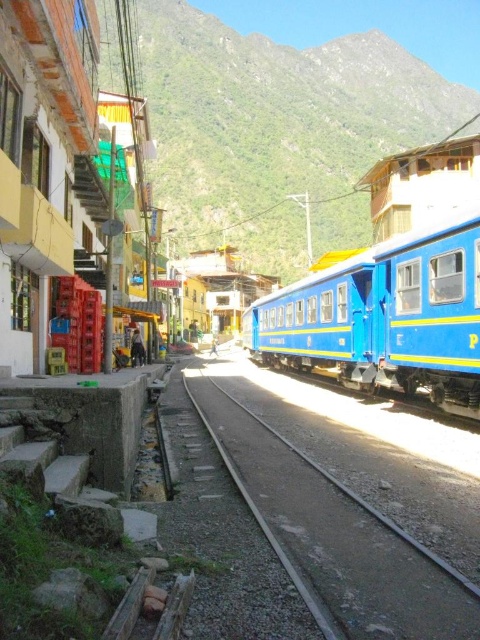
The height and width of the screenshot is (640, 480). In order to click on green leafy mountain at upper center in this screenshot , I will do `click(276, 131)`.

Who is positioned more to the right, green leafy mountain at upper center or blue matte train at right?

green leafy mountain at upper center is more to the right.

From the picture: Who is more distant from viewer, (x=268, y=236) or (x=326, y=268)?

Point (x=268, y=236)

You are a GUI agent. You are given a task and a screenshot of the screen. Output one action in this format:
    pyautogui.click(x=<x>, y=<y>)
    Task: Click on the green leafy mountain at upper center
    
    Given the screenshot: What is the action you would take?
    pyautogui.click(x=276, y=131)

Is blue matte train at right to the left of gray gravel track at center from the viewer's perspective?

In fact, blue matte train at right is to the right of gray gravel track at center.

Is blue matte train at right to the right of gray gravel track at center from the viewer's perspective?

Indeed, blue matte train at right is positioned on the right side of gray gravel track at center.

Does point (266, 304) come closer to viewer compared to point (445, 634)?

No, (266, 304) is behind (445, 634).

Locate an element on the screen. The width and height of the screenshot is (480, 640). blue matte train at right is located at coordinates (393, 289).

Can you confirm if green leafy mountain at upper center is wider than gray gravel track at center?

Yes.

Is green leafy mountain at upper center shorter than gray gravel track at center?

Incorrect, green leafy mountain at upper center's height does not fall short of gray gravel track at center's.

The image size is (480, 640). What are the coordinates of `green leafy mountain at upper center` in the screenshot? It's located at (276, 131).